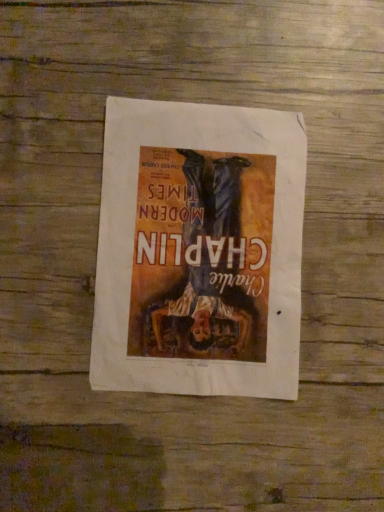
At what (x,y) coordinates should I click in order to perform the action: click on free space above matte paper poster at center (from a real-world perspective). Please return your answer as a coordinate pair (x, y). Looking at the image, I should click on (204, 244).